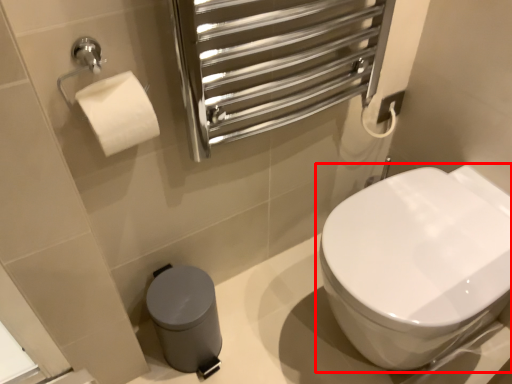
Question: From the image's perspective, what is the correct spatial relationship of toilet (annotated by the red box) in relation to porcelain?

Choices:
 (A) below
 (B) above

Answer: (B)